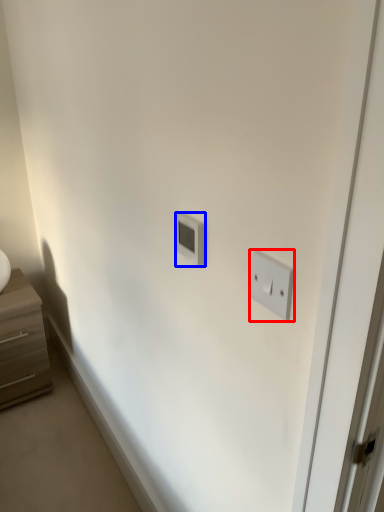
Question: Which object is closer to the camera taking this photo, light switch (highlighted by a red box) or light switch (highlighted by a blue box)?

Choices:
 (A) light switch
 (B) light switch

Answer: (A)